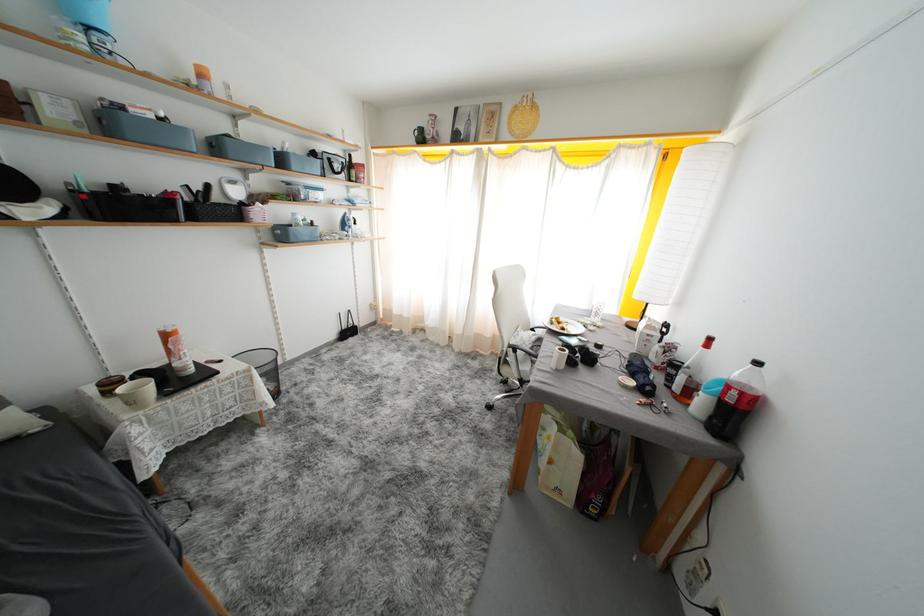
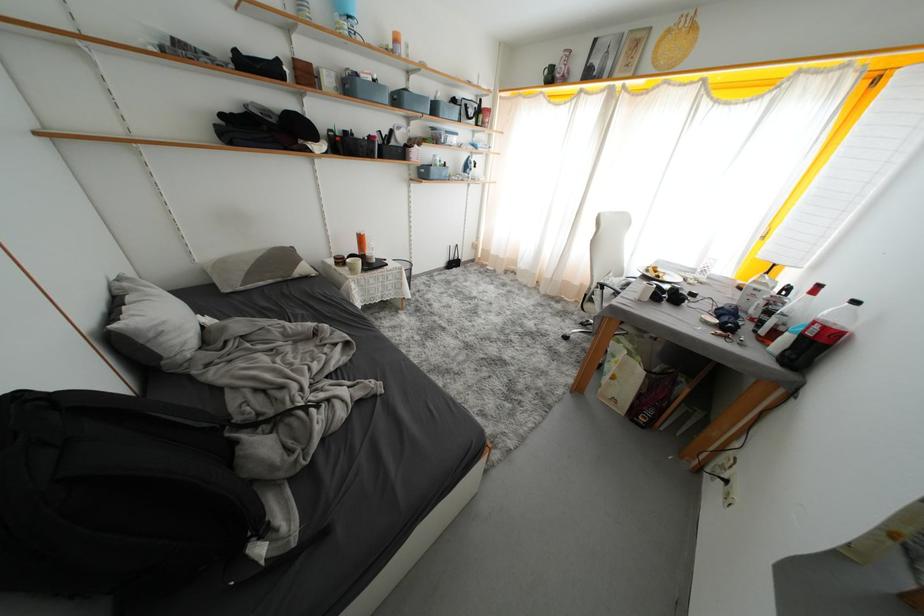
Find the pixel in the second image that matches point 505,362 in the first image.

(591, 299)